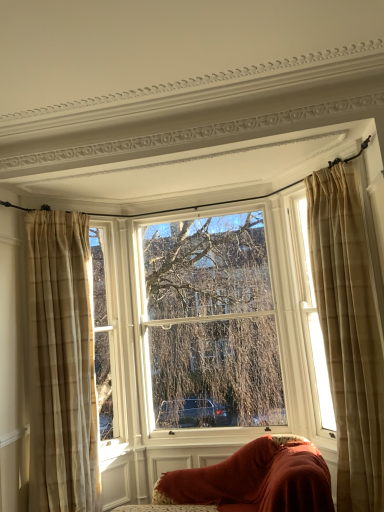
Question: Is the position of clear glass window at center, marked as the 1th window in a left-to-right arrangement, less distant than that of sheer beige curtains at right, which appears as the 1th window when viewed from the right?

Choices:
 (A) no
 (B) yes

Answer: (A)

Question: Considering the relative sizes of clear glass window at center, marked as the 1th window in a left-to-right arrangement, and sheer beige curtains at right, which is the 2th window from left to right, in the image provided, is clear glass window at center, marked as the 1th window in a left-to-right arrangement, taller than sheer beige curtains at right, which is the 2th window from left to right,?

Choices:
 (A) no
 (B) yes

Answer: (B)

Question: From the image's perspective, would you say clear glass window at center, placed as the 2th window when sorted from right to left, is shown under sheer beige curtains at right, which is the 2th window from left to right?

Choices:
 (A) no
 (B) yes

Answer: (B)

Question: From a real-world perspective, is clear glass window at center, marked as the 1th window in a left-to-right arrangement, located beneath sheer beige curtains at right, which is the 2th window from left to right?

Choices:
 (A) no
 (B) yes

Answer: (B)

Question: Does clear glass window at center, placed as the 2th window when sorted from right to left, lie behind sheer beige curtains at right, which is the 2th window from left to right?

Choices:
 (A) yes
 (B) no

Answer: (A)

Question: Is velvet red sofa at lower center wider or thinner than beige plaid curtain at right, which ranks as the second curtain in left-to-right order?

Choices:
 (A) thin
 (B) wide

Answer: (A)

Question: Is velvet red sofa at lower center to the left or to the right of beige plaid curtain at right, which is counted as the first curtain, starting from the right, in the image?

Choices:
 (A) left
 (B) right

Answer: (A)

Question: Considering their positions, is velvet red sofa at lower center located in front of or behind beige plaid curtain at right, which is counted as the first curtain, starting from the right?

Choices:
 (A) front
 (B) behind

Answer: (B)

Question: Is velvet red sofa at lower center taller or shorter than beige plaid curtain at right, which ranks as the second curtain in left-to-right order?

Choices:
 (A) tall
 (B) short

Answer: (B)

Question: Considering the positions of velvet red sofa at lower center and beige plaid curtain at left, arranged as the 1th curtain when viewed from the left, in the image, is velvet red sofa at lower center taller or shorter than beige plaid curtain at left, arranged as the 1th curtain when viewed from the left,?

Choices:
 (A) tall
 (B) short

Answer: (B)

Question: Looking at the image, does velvet red sofa at lower center seem bigger or smaller compared to beige plaid curtain at left, arranged as the 1th curtain when viewed from the left?

Choices:
 (A) small
 (B) big

Answer: (A)

Question: From a real-world perspective, is velvet red sofa at lower center physically located above or below beige plaid curtain at left, which ranks as the second curtain in right-to-left order?

Choices:
 (A) below
 (B) above

Answer: (A)

Question: In terms of width, does velvet red sofa at lower center look wider or thinner when compared to beige plaid curtain at left, arranged as the 1th curtain when viewed from the left?

Choices:
 (A) thin
 (B) wide

Answer: (A)

Question: Does point (317, 252) appear closer or farther from the camera than point (332, 419)?

Choices:
 (A) closer
 (B) farther

Answer: (A)

Question: Based on their sizes in the image, would you say beige plaid curtain at right, which is counted as the first curtain, starting from the right, is bigger or smaller than sheer beige curtains at right, which appears as the 1th window when viewed from the right?

Choices:
 (A) small
 (B) big

Answer: (B)